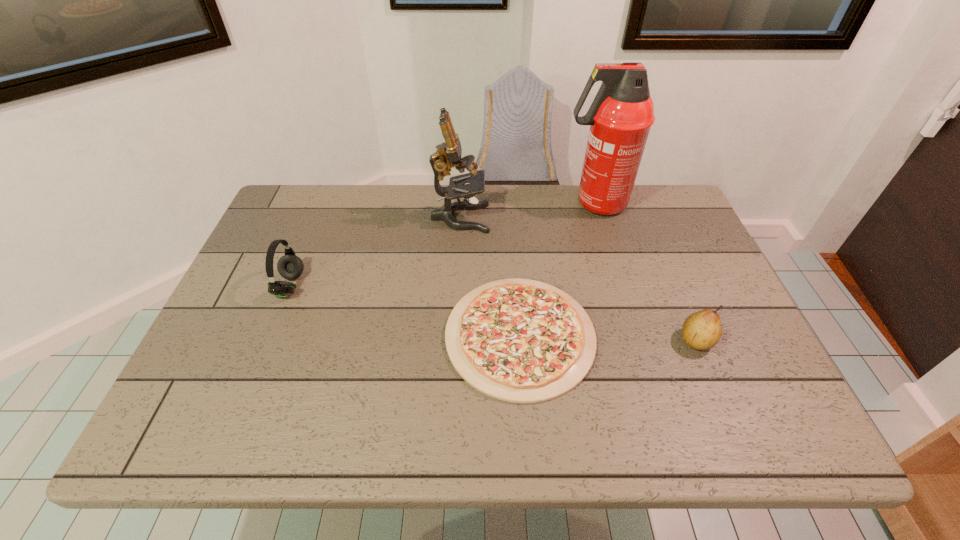
The image size is (960, 540). In order to click on free space at the far edge of the desktop in this screenshot , I will do `click(501, 184)`.

Find the location of `free space at the near edge`. free space at the near edge is located at coordinates (484, 416).

I want to click on vacant space at the right edge, so click(645, 250).

In the image, there is a desktop. At what (x,y) coordinates should I click in order to perform the action: click on vacant space at the far left corner. Please return your answer as a coordinate pair (x, y). The width and height of the screenshot is (960, 540). Looking at the image, I should click on (309, 208).

Where is `free space at the far right corner of the desktop`? The image size is (960, 540). free space at the far right corner of the desktop is located at coordinates (643, 213).

Where is `vacant area that lies between the third shortest object and the fourth shortest object`? The image size is (960, 540). vacant area that lies between the third shortest object and the fourth shortest object is located at coordinates (375, 252).

Identify the location of free space between the tallest object and the leftmost object. (443, 245).

Identify the location of vacant area that lies between the tallest object and the third shortest object. (443, 245).

You are a GUI agent. You are given a task and a screenshot of the screen. Output one action in this format:
    pyautogui.click(x=<x>, y=<y>)
    Task: Click on the free space between the fourth tallest object and the second tallest object
    
    Given the screenshot: What is the action you would take?
    pyautogui.click(x=578, y=279)

Find the location of `vacant point located between the microscope and the fire extinguisher`. vacant point located between the microscope and the fire extinguisher is located at coordinates (527, 211).